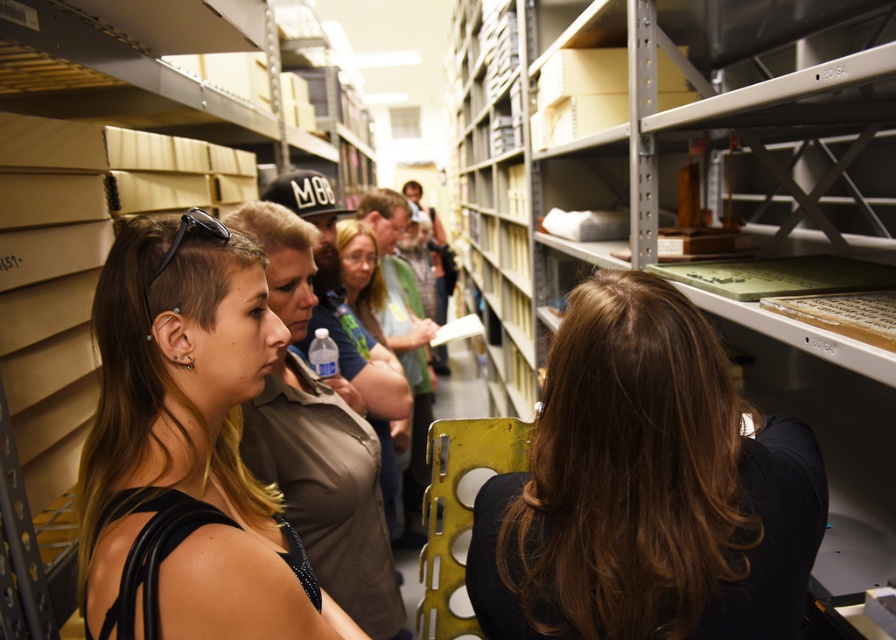
Question: Is metallic gray bookshelf at upper right positioned in front of matte blue shirt at center?

Choices:
 (A) no
 (B) yes

Answer: (B)

Question: Considering the real-world distances, which object is farthest from the brown hair at center?

Choices:
 (A) matte blue shirt at center
 (B) metallic gray bookshelf at upper right

Answer: (A)

Question: Which of these objects is positioned closest to the metallic gray bookshelf at upper right?

Choices:
 (A) matte blue shirt at center
 (B) brown hair at center
 (C) matte black tank top at center

Answer: (B)

Question: Is metallic gray bookshelf at upper right to the right of matte black tank top at center from the viewer's perspective?

Choices:
 (A) no
 (B) yes

Answer: (B)

Question: Which is nearer to the matte blue shirt at center?

Choices:
 (A) brown hair at center
 (B) metallic gray bookshelf at upper right

Answer: (B)

Question: Observing the image, what is the correct spatial positioning of metallic gray bookshelf at upper right in reference to matte black tank top at center?

Choices:
 (A) below
 (B) above

Answer: (B)